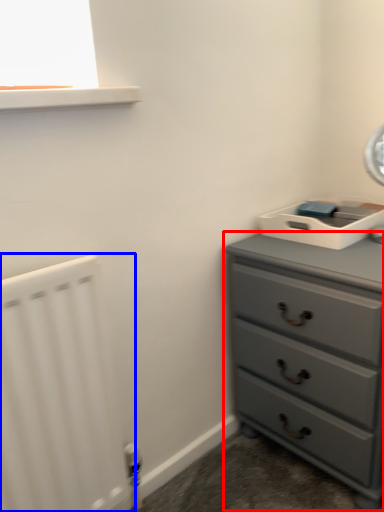
Question: Which of the following is the closest to the observer, chest of drawers (highlighted by a red box) or radiator (highlighted by a blue box)?

Choices:
 (A) chest of drawers
 (B) radiator

Answer: (B)